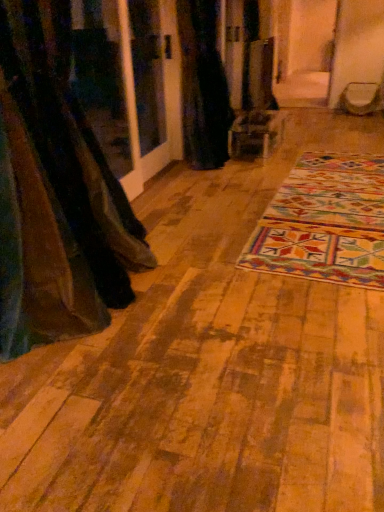
Question: Is brown fabric curtain at left, placed as the second curtain when sorted from top to bottom, aimed at multicolored woven mat at center?

Choices:
 (A) no
 (B) yes

Answer: (A)

Question: From the image's perspective, would you say brown fabric curtain at left, which appears as the second curtain when viewed from the right, is positioned over multicolored woven mat at center?

Choices:
 (A) yes
 (B) no

Answer: (B)

Question: Can you confirm if brown fabric curtain at left, acting as the first curtain starting from the bottom, is thinner than multicolored woven mat at center?

Choices:
 (A) yes
 (B) no

Answer: (A)

Question: Is brown fabric curtain at left, placed as the second curtain when sorted from top to bottom, located outside multicolored woven mat at center?

Choices:
 (A) yes
 (B) no

Answer: (A)

Question: Is brown fabric curtain at left, which is counted as the 1th curtain, starting from the left, with multicolored woven mat at center?

Choices:
 (A) yes
 (B) no

Answer: (B)

Question: Does black fabric curtain at center, the first curtain from the back, come in front of multicolored woven mat at center?

Choices:
 (A) yes
 (B) no

Answer: (B)

Question: Is black fabric curtain at center, marked as the second curtain in a left-to-right arrangement, at the left side of multicolored woven mat at center?

Choices:
 (A) no
 (B) yes

Answer: (B)

Question: Could you tell me if black fabric curtain at center, marked as the 1th curtain in a right-to-left arrangement, is turned towards multicolored woven mat at center?

Choices:
 (A) no
 (B) yes

Answer: (A)

Question: Can you confirm if black fabric curtain at center, the first curtain from the back, is shorter than multicolored woven mat at center?

Choices:
 (A) yes
 (B) no

Answer: (B)

Question: From a real-world perspective, is black fabric curtain at center, which appears as the 2th curtain when ordered from the bottom, positioned under multicolored woven mat at center based on gravity?

Choices:
 (A) no
 (B) yes

Answer: (A)

Question: Is black fabric curtain at center, marked as the 1th curtain in a right-to-left arrangement, bigger than multicolored woven mat at center?

Choices:
 (A) no
 (B) yes

Answer: (B)

Question: Does multicolored woven mat at center have a lesser width compared to brown fabric curtain at left, acting as the second curtain starting from the back?

Choices:
 (A) yes
 (B) no

Answer: (B)